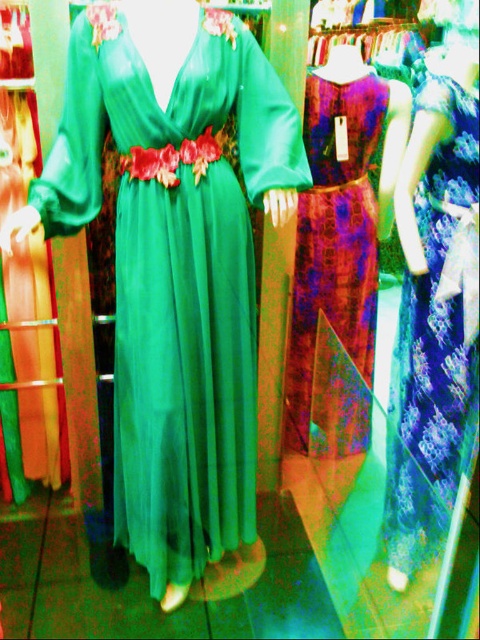
Does green satin dress at center have a larger size compared to patterned silk dress at center?

Yes, green satin dress at center is bigger than patterned silk dress at center.

Is point (149, 513) farther from viewer compared to point (303, 419)?

That is False.

Locate an element on the screen. green satin dress at center is located at coordinates (177, 269).

Between green satin dress at center and blue floral dress at right, which one is positioned lower?

blue floral dress at right

From the picture: Between green satin dress at center and blue floral dress at right, which one has more height?

With more height is green satin dress at center.

Who is more distant from viewer, [171,438] or [464,332]?

Positioned behind is point [171,438].

Where is `green satin dress at center`? green satin dress at center is located at coordinates click(x=177, y=269).

From the picture: Is blue floral dress at right shorter than patterned silk dress at center?

Incorrect, blue floral dress at right's height does not fall short of patterned silk dress at center's.

Who is more distant from viewer, (428, 460) or (300, 340)?

Positioned behind is point (300, 340).

Is point (430, 513) farther from viewer compared to point (371, 100)?

No, (430, 513) is in front of (371, 100).

The width and height of the screenshot is (480, 640). In order to click on blue floral dress at right in this screenshot , I will do `click(434, 333)`.